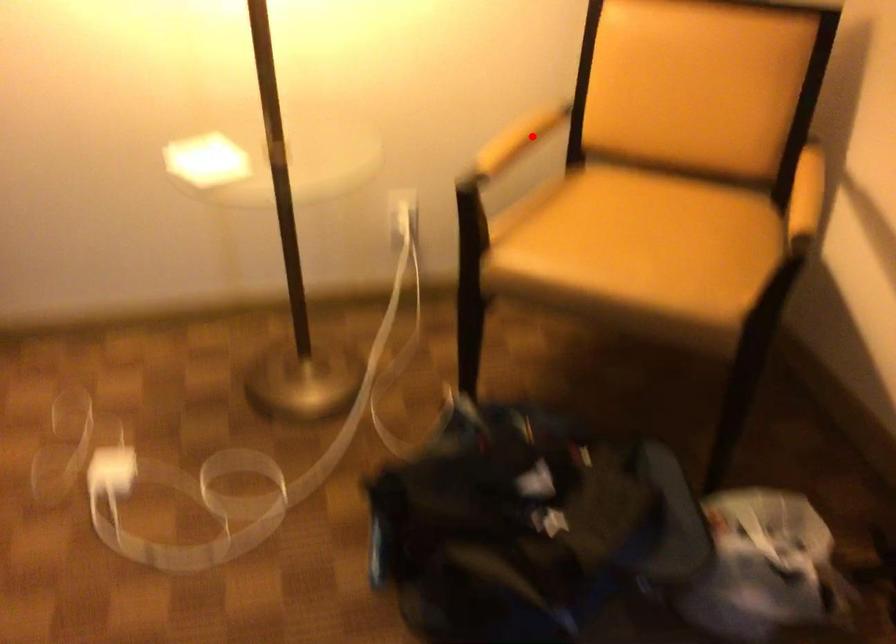
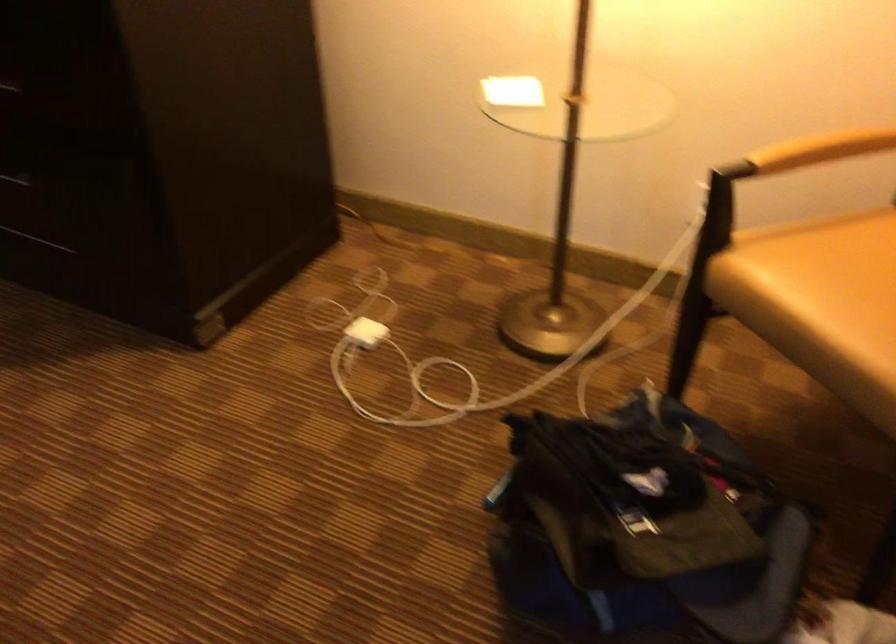
Find the pixel in the second image that matches the highlighted location in the first image.

(821, 149)